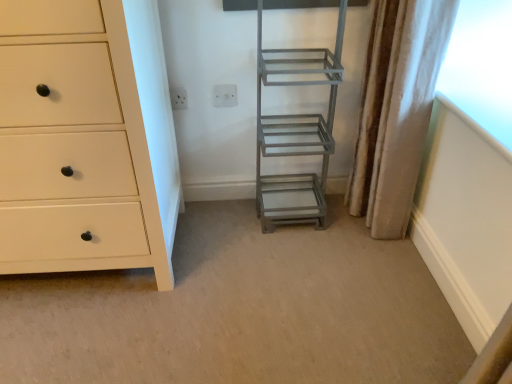
Locate an element on the screen. vacant space in front of metallic gray ladder at center is located at coordinates (310, 255).